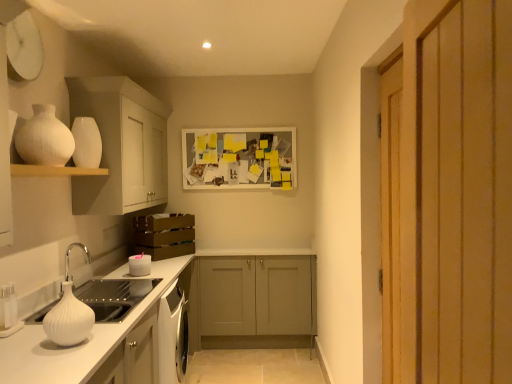
Question: Visually, is white matte shelf at upper left positioned to the left or to the right of white matte cabinet at upper left, the first cabinetry in the top-to-bottom sequence?

Choices:
 (A) left
 (B) right

Answer: (A)

Question: From the image's perspective, is white matte shelf at upper left positioned above or below white matte cabinet at upper left, marked as the first cabinetry in a front-to-back arrangement?

Choices:
 (A) below
 (B) above

Answer: (A)

Question: Which object is the closest to the white glossy vase at upper left?

Choices:
 (A) white glossy vase at left, which is the 1th vase in bottom-to-top order
 (B) white matte cabinet at upper left, positioned as the second cabinetry in bottom-to-top order
 (C) white matte candle at lower left
 (D) white matte shelf at upper left
 (E) matte gray cabinet at center, which is the 1th cabinetry in back-to-front order

Answer: (D)

Question: Based on their relative distances, which object is nearer to the white glossy vase at left, which is the 1th vase from right to left?

Choices:
 (A) matte gray cabinet at center, which ranks as the first cabinetry in bottom-to-top order
 (B) white glossy vase at upper left, which is counted as the 1th vase, starting from the left
 (C) white matte sink at lower left
 (D) white glossy vase at upper left
 (E) white matte picture frame at center

Answer: (C)